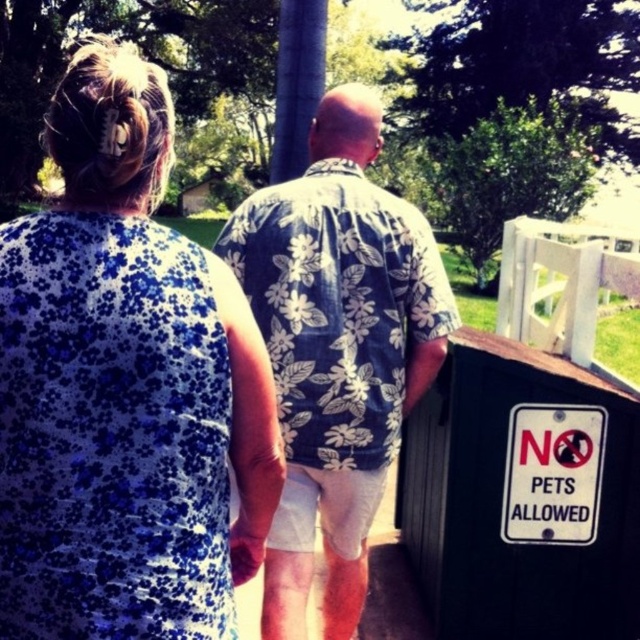
Question: Is blue floral dress at upper left to the right of floral fabric shirt at center from the viewer's perspective?

Choices:
 (A) yes
 (B) no

Answer: (B)

Question: Is the position of blue floral dress at upper left less distant than that of floral fabric shirt at center?

Choices:
 (A) no
 (B) yes

Answer: (B)

Question: Which object is farther from the camera taking this photo?

Choices:
 (A) blue floral dress at upper left
 (B) floral fabric shirt at center

Answer: (B)

Question: Which object is farther from the camera taking this photo?

Choices:
 (A) floral fabric shirt at center
 (B) blue floral dress at upper left

Answer: (A)

Question: Is blue floral dress at upper left in front of floral fabric shirt at center?

Choices:
 (A) no
 (B) yes

Answer: (B)